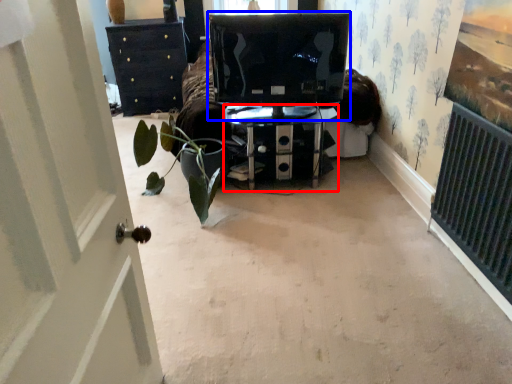
Question: Which of the following is the closest to the observer, furniture (highlighted by a red box) or computer monitor (highlighted by a blue box)?

Choices:
 (A) furniture
 (B) computer monitor

Answer: (B)